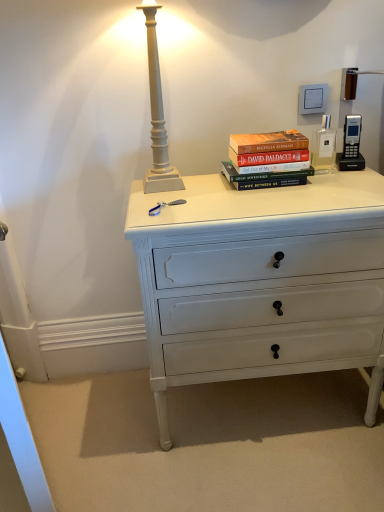
Locate an element on the screen. free point above white painted wood chest of drawers at center (from a real-world perspective) is located at coordinates (290, 188).